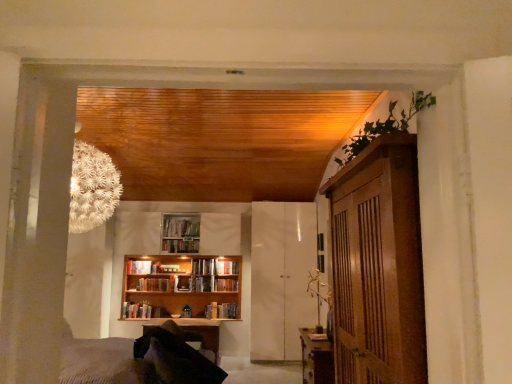
Question: Does wooden bookshelf at center, which is the 1th book in top-to-bottom order, lie in front of wooden bookshelf at center, positioned as the 5th book in top-to-bottom order?

Choices:
 (A) yes
 (B) no

Answer: (A)

Question: Are wooden bookshelf at center, which is the 1th book in top-to-bottom order, and wooden bookshelf at center, positioned as the 5th book in top-to-bottom order, located far from each other?

Choices:
 (A) yes
 (B) no

Answer: (B)

Question: Is wooden bookshelf at center, which is the 1th book in top-to-bottom order, in contact with wooden bookshelf at center, positioned as the 5th book in top-to-bottom order?

Choices:
 (A) no
 (B) yes

Answer: (A)

Question: From a real-world perspective, is wooden bookshelf at center, which is the 1th book in top-to-bottom order, located higher than wooden bookshelf at center, positioned as the 5th book in top-to-bottom order?

Choices:
 (A) yes
 (B) no

Answer: (A)

Question: Can you confirm if wooden bookshelf at center, which is the 1th book in top-to-bottom order, is smaller than wooden bookshelf at center, positioned as the second book in bottom-to-top order?

Choices:
 (A) no
 (B) yes

Answer: (B)

Question: From a real-world perspective, is hardcover book at center, marked as the 5th book in a bottom-to-top arrangement, above or below wooden table at right, which is the 1th table from right to left?

Choices:
 (A) below
 (B) above

Answer: (B)

Question: Relative to wooden table at right, placed as the second table when sorted from bottom to top, is hardcover book at center, marked as the 5th book in a bottom-to-top arrangement, in front or behind?

Choices:
 (A) front
 (B) behind

Answer: (B)

Question: In terms of size, does hardcover book at center, the 2th book when ordered from top to bottom, appear bigger or smaller than wooden table at right, positioned as the 1th table in top-to-bottom order?

Choices:
 (A) small
 (B) big

Answer: (A)

Question: In terms of height, does hardcover book at center, the 2th book when ordered from top to bottom, look taller or shorter compared to wooden table at right, placed as the second table when sorted from bottom to top?

Choices:
 (A) short
 (B) tall

Answer: (A)

Question: Is hardcover book at center, arranged as the fourth book when viewed from the top, wider or thinner than white glossy cabinet at center?

Choices:
 (A) wide
 (B) thin

Answer: (B)

Question: Is hardcover book at center, arranged as the fourth book when viewed from the top, in front of or behind white glossy cabinet at center in the image?

Choices:
 (A) front
 (B) behind

Answer: (B)

Question: Which is correct: hardcover book at center, arranged as the fourth book when viewed from the top, is inside white glossy cabinet at center, or outside of it?

Choices:
 (A) inside
 (B) outside

Answer: (B)

Question: From a real-world perspective, is hardcover book at center, arranged as the fourth book when viewed from the top, positioned above or below white glossy cabinet at center?

Choices:
 (A) below
 (B) above

Answer: (B)

Question: In the image, is wooden bookcase at center positioned in front of or behind wooden bookshelf at center, positioned as the second book in bottom-to-top order?

Choices:
 (A) behind
 (B) front

Answer: (B)

Question: From a real-world perspective, relative to wooden bookshelf at center, positioned as the 5th book in top-to-bottom order, is wooden bookcase at center vertically above or below?

Choices:
 (A) below
 (B) above

Answer: (A)